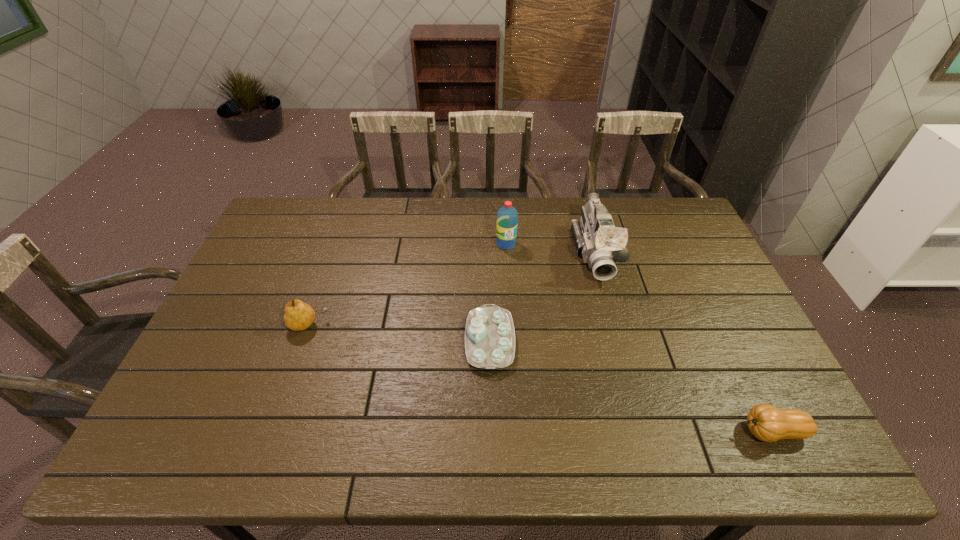
I want to click on vacant space that is in between the gourd and the fourth shortest object, so point(638,338).

Locate an element on the screen. The image size is (960, 540). empty space between the chinaware and the fourth object from left to right is located at coordinates (x=542, y=297).

Locate an element on the screen. free space that is in between the chinaware and the camcorder is located at coordinates [542, 297].

This screenshot has width=960, height=540. Find the location of `empty space between the third tallest object and the second object from right to left`. empty space between the third tallest object and the second object from right to left is located at coordinates (452, 289).

Identify the location of object that is the fourth closest to the camcorder. The height and width of the screenshot is (540, 960). (298, 316).

Where is `object that is the second closest to the chinaware`? Image resolution: width=960 pixels, height=540 pixels. object that is the second closest to the chinaware is located at coordinates (507, 216).